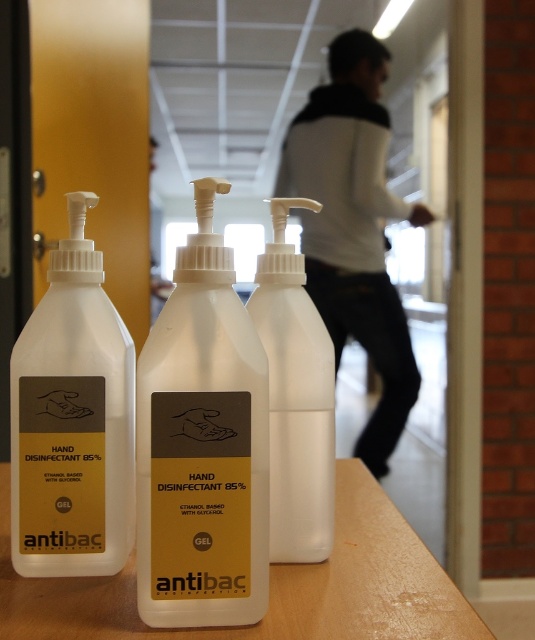
Question: Which object is positioned farthest from the white plastic hand sanitizer at center?

Choices:
 (A) white plastic table at center
 (B) white matte hand sanitizer at center

Answer: (B)

Question: Among these points, which one is nearest to the camera?

Choices:
 (A) tap(187, 435)
 (B) tap(432, 634)
 (C) tap(18, 442)
 (D) tap(327, 106)

Answer: (B)

Question: Which point is closer to the camera?

Choices:
 (A) white gel hand disinfectant at center
 (B) white plastic table at center
 (C) white matte hand sanitizer at center
 (D) white matte hand sanitizer at left

Answer: (B)

Question: Is white plastic table at center closer to the viewer compared to white matte hand sanitizer at center?

Choices:
 (A) no
 (B) yes

Answer: (B)

Question: Can you confirm if white matte hand sanitizer at left is positioned below white plastic table at center?

Choices:
 (A) no
 (B) yes

Answer: (A)

Question: Does white matte hand sanitizer at left come in front of white plastic table at center?

Choices:
 (A) yes
 (B) no

Answer: (B)